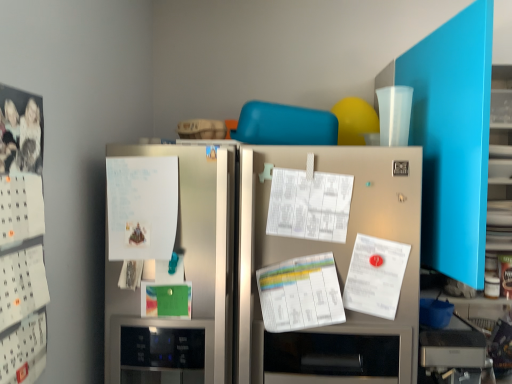
Question: From a real-world perspective, is satin silver refrigerator at center above or below white paper calendar at left?

Choices:
 (A) below
 (B) above

Answer: (A)

Question: In terms of size, does satin silver refrigerator at center appear bigger or smaller than white paper calendar at left?

Choices:
 (A) small
 (B) big

Answer: (B)

Question: Which of these objects is positioned farthest from the white paper at left?

Choices:
 (A) white paper calendar at left
 (B) satin silver refrigerator at center

Answer: (A)

Question: Based on their relative distances, which object is farther from the white paper calendar at left?

Choices:
 (A) white paper at left
 (B) satin silver refrigerator at center

Answer: (B)